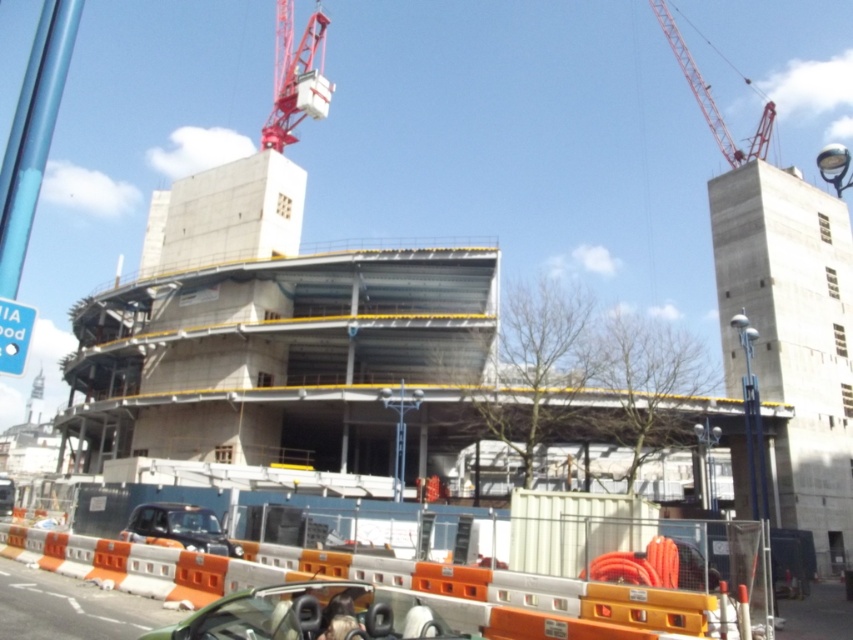
Is green matte convertible at center positioned behind matte black car at lower center?

No, green matte convertible at center is in front of matte black car at lower center.

Is green matte convertible at center positioned in front of matte black car at lower center?

Yes.

Who is more distant from viewer, (175, 625) or (165, 509)?

Positioned behind is point (165, 509).

The width and height of the screenshot is (853, 640). Find the location of `green matte convertible at center`. green matte convertible at center is located at coordinates (314, 614).

Who is higher up, metallic red crane at upper center or metallic red crane at upper right?

metallic red crane at upper center is higher up.

Which is below, metallic red crane at upper center or metallic red crane at upper right?

metallic red crane at upper right is lower down.

Locate an element on the screen. metallic red crane at upper center is located at coordinates (294, 76).

At what (x,y) coordinates should I click in order to perform the action: click on metallic red crane at upper center. Please return your answer as a coordinate pair (x, y). This screenshot has height=640, width=853. Looking at the image, I should click on (294, 76).

Is green matte convertible at center smaller than metallic red crane at upper right?

Indeed, green matte convertible at center has a smaller size compared to metallic red crane at upper right.

Is green matte convertible at center thinner than metallic red crane at upper right?

Yes.

Is point (426, 605) closer to viewer compared to point (688, 67)?

Yes, it is in front of point (688, 67).

This screenshot has height=640, width=853. Find the location of `green matte convertible at center`. green matte convertible at center is located at coordinates (314, 614).